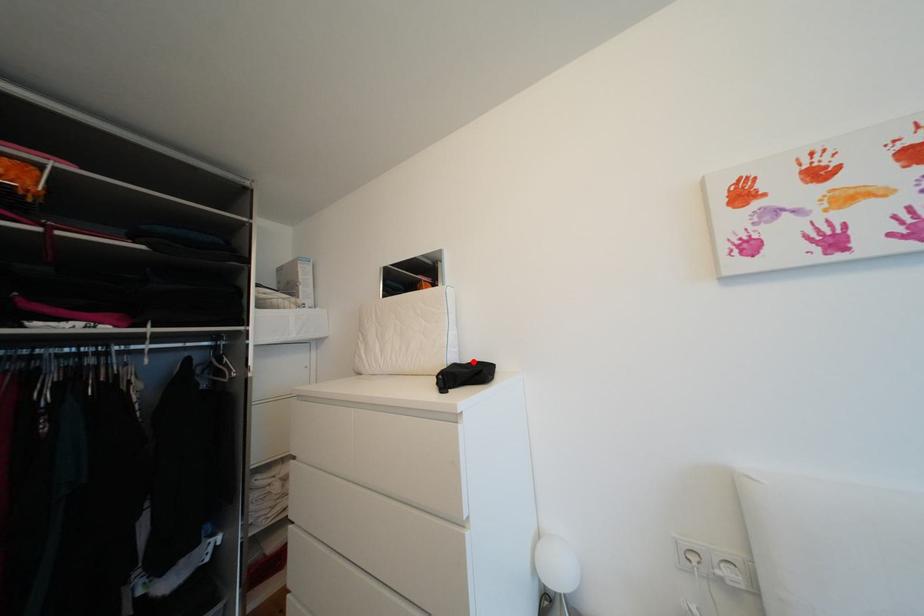
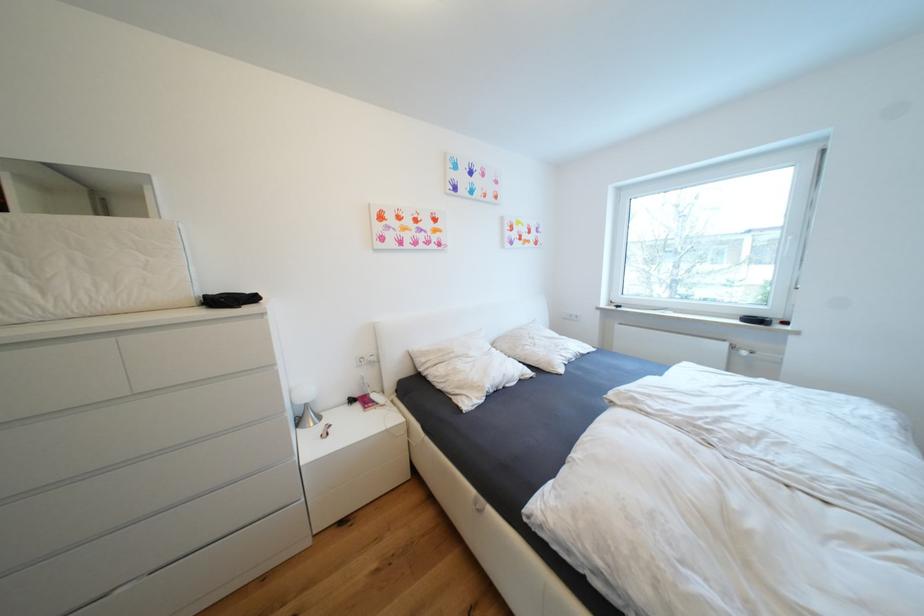
Where in the second image is the point corresponding to the highlighted location from the first image?

(222, 294)